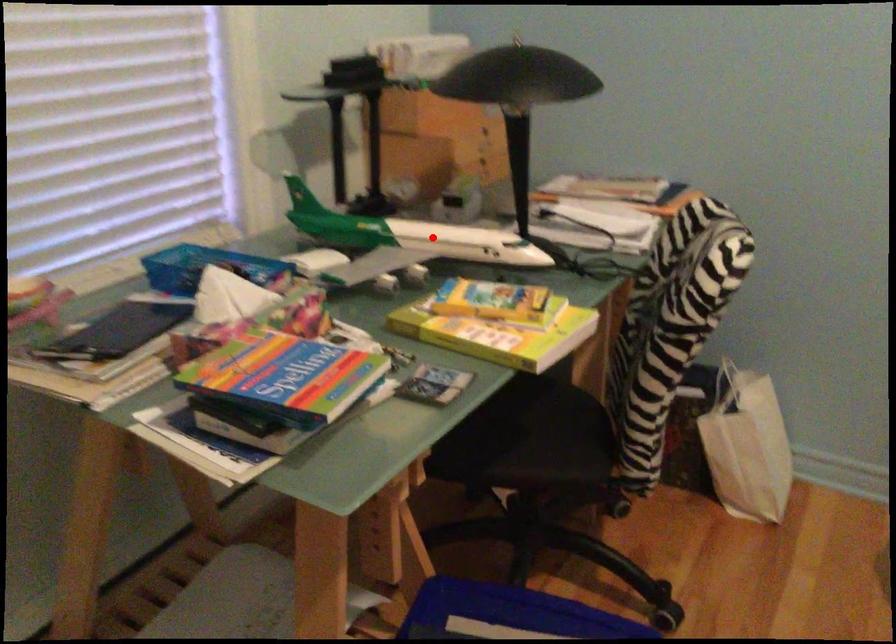
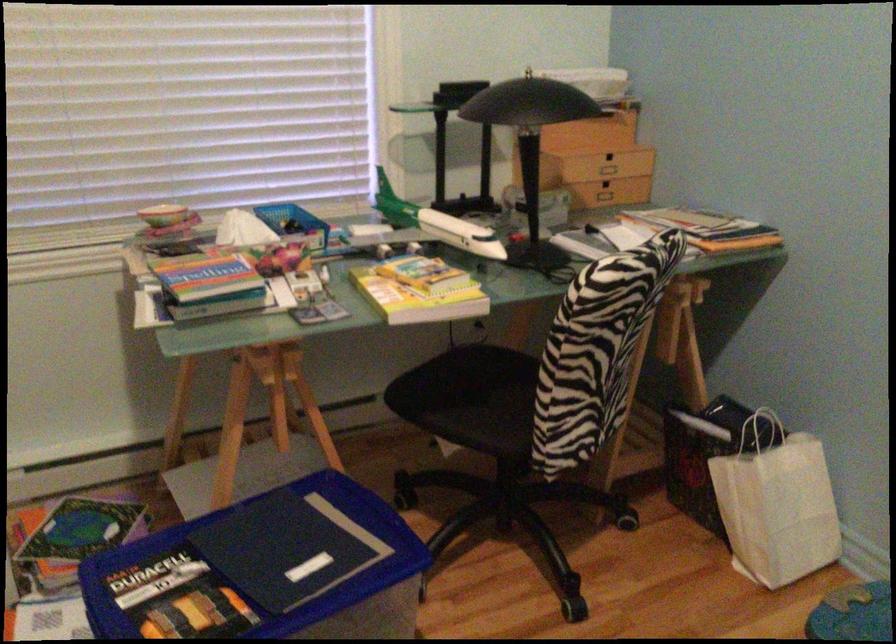
Where in the second image is the point corresponding to the highlighted location from the first image?

(438, 225)